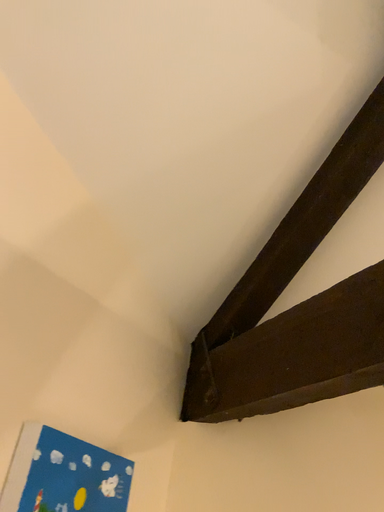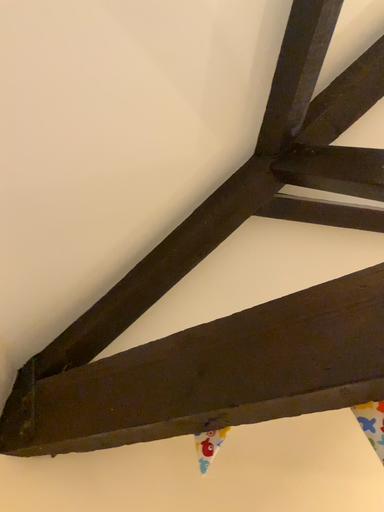
Question: Which way did the camera rotate in the video?

Choices:
 (A) rotated right
 (B) rotated left

Answer: (A)